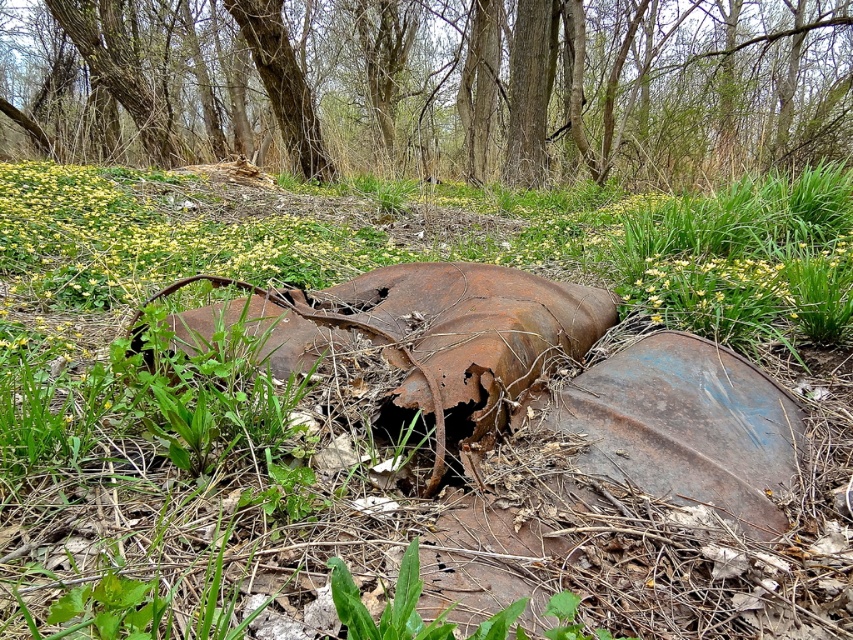
Question: Which object appears farthest from the camera in this image?

Choices:
 (A) green grass at center
 (B) smooth bark tree at upper center

Answer: (B)

Question: Which object appears farthest from the camera in this image?

Choices:
 (A) green grass at center
 (B) smooth bark tree at upper center

Answer: (B)

Question: Is green grass at center closer to the viewer compared to smooth bark tree at upper center?

Choices:
 (A) no
 (B) yes

Answer: (B)

Question: Can you confirm if green grass at center is positioned above smooth bark tree at upper center?

Choices:
 (A) no
 (B) yes

Answer: (A)

Question: Does green grass at center have a larger size compared to smooth bark tree at upper center?

Choices:
 (A) yes
 (B) no

Answer: (B)